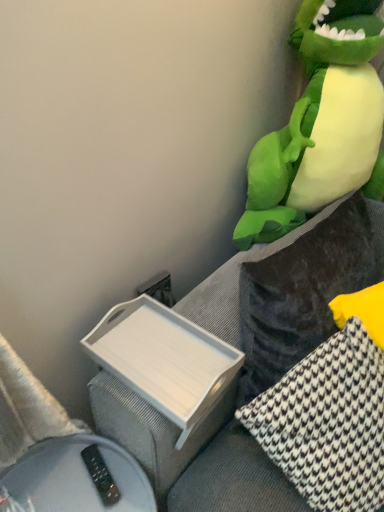
Question: Can you confirm if velvet dark gray couch at right is shorter than white wood tray at lower left?

Choices:
 (A) yes
 (B) no

Answer: (B)

Question: From the image's perspective, is velvet dark gray couch at right located beneath white wood tray at lower left?

Choices:
 (A) yes
 (B) no

Answer: (B)

Question: Does velvet dark gray couch at right contain white wood tray at lower left?

Choices:
 (A) no
 (B) yes

Answer: (A)

Question: Is velvet dark gray couch at right wider than white wood tray at lower left?

Choices:
 (A) yes
 (B) no

Answer: (B)

Question: From a real-world perspective, is velvet dark gray couch at right positioned over white wood tray at lower left based on gravity?

Choices:
 (A) no
 (B) yes

Answer: (A)

Question: Is velvet dark gray couch at right completely or partially outside of white wood tray at lower left?

Choices:
 (A) no
 (B) yes

Answer: (B)

Question: From the image's perspective, does velvet dark gray couch at right appear higher than white houndstooth pillow at right, marked as the 1th pillow in a right-to-left arrangement?

Choices:
 (A) no
 (B) yes

Answer: (B)

Question: Is velvet dark gray couch at right closer to camera compared to white houndstooth pillow at right, marked as the 1th pillow in a right-to-left arrangement?

Choices:
 (A) yes
 (B) no

Answer: (B)

Question: From a real-world perspective, is velvet dark gray couch at right below white houndstooth pillow at right, which ranks as the 2th pillow in left-to-right order?

Choices:
 (A) yes
 (B) no

Answer: (A)

Question: Considering the relative sizes of velvet dark gray couch at right and white houndstooth pillow at right, which ranks as the 2th pillow in left-to-right order, in the image provided, is velvet dark gray couch at right smaller than white houndstooth pillow at right, which ranks as the 2th pillow in left-to-right order,?

Choices:
 (A) yes
 (B) no

Answer: (A)

Question: Is velvet dark gray couch at right with white houndstooth pillow at right, marked as the 1th pillow in a right-to-left arrangement?

Choices:
 (A) yes
 (B) no

Answer: (B)

Question: Is the depth of velvet dark gray couch at right greater than that of white houndstooth pillow at right, which ranks as the 2th pillow in left-to-right order?

Choices:
 (A) no
 (B) yes

Answer: (B)

Question: Is green plush toy at upper right taller than white plastic tray at lower left?

Choices:
 (A) no
 (B) yes

Answer: (B)